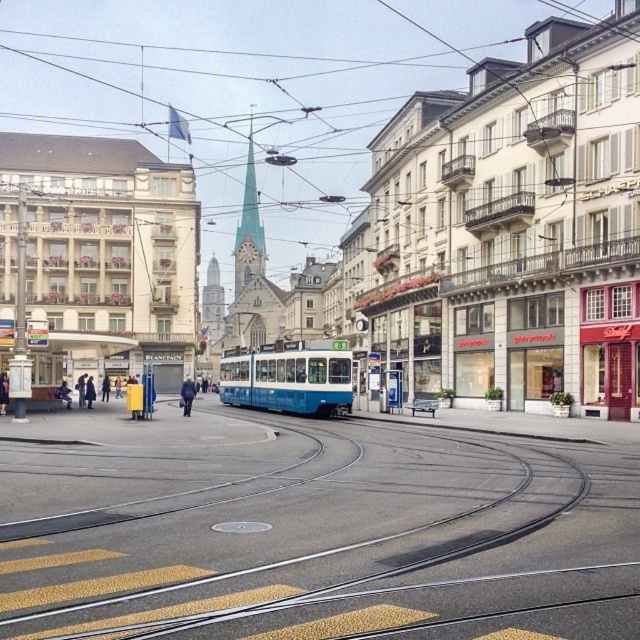
Who is shorter, metallic track at center or smooth white spire at center?

With less height is metallic track at center.

Image resolution: width=640 pixels, height=640 pixels. I want to click on metallic track at center, so click(x=310, y=529).

Where is `metallic track at center`? metallic track at center is located at coordinates (310, 529).